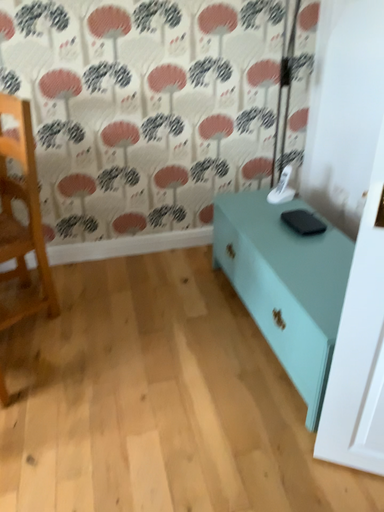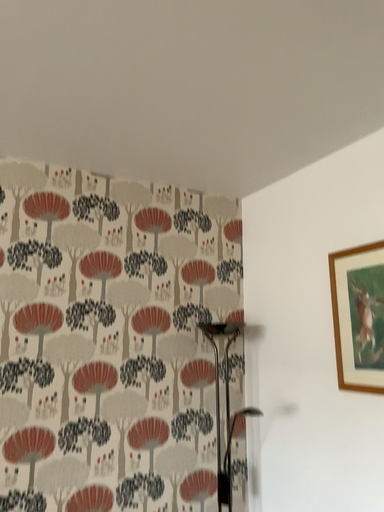
Question: Which way did the camera rotate in the video?

Choices:
 (A) rotated left
 (B) rotated right

Answer: (B)